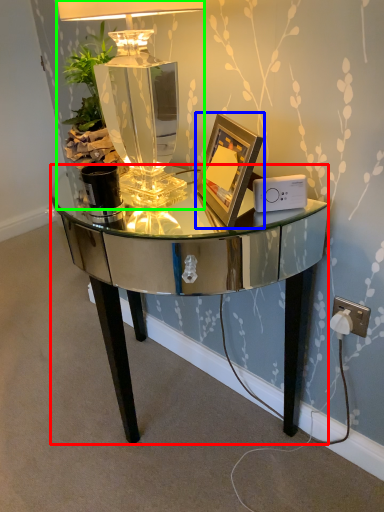
Question: Estimate the real-world distances between objects in this image. Which object is farther from desk (highlighted by a red box), picture frame (highlighted by a blue box) or lamp (highlighted by a green box)?

Choices:
 (A) picture frame
 (B) lamp

Answer: (B)